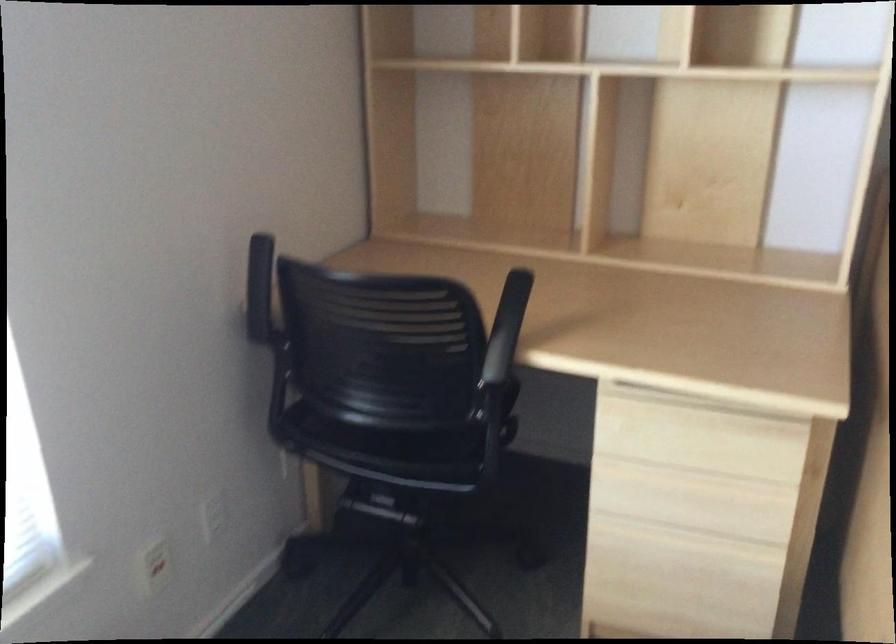
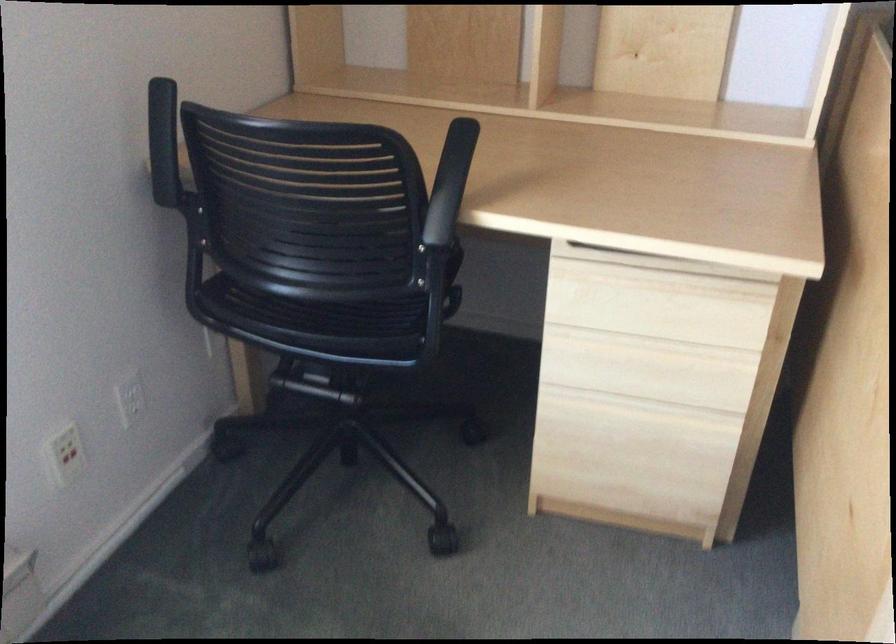
The point at (677,538) is marked in the first image. Where is the corresponding point in the second image?

(632, 409)